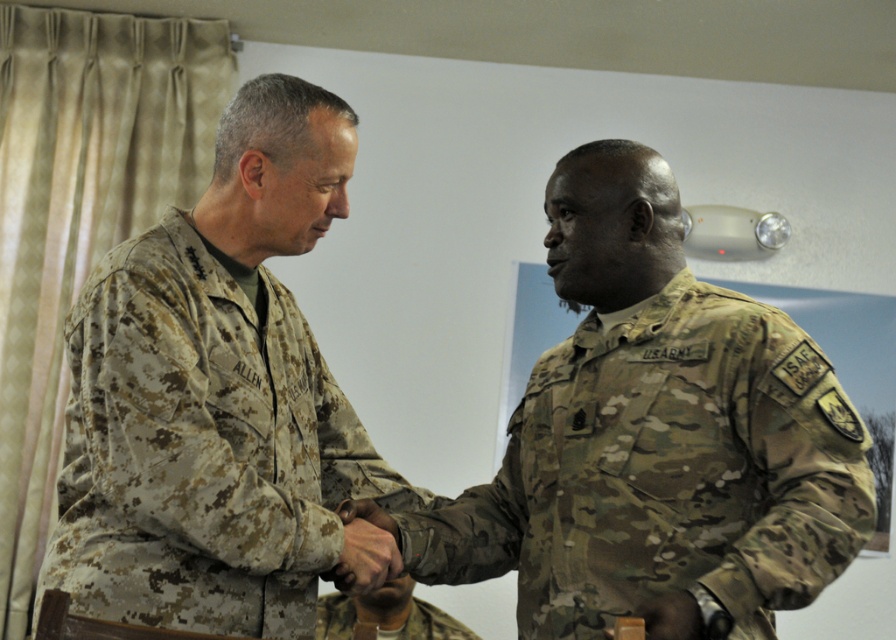
Question: Which of the following is the closest to the observer?

Choices:
 (A) (382, 605)
 (B) (623, 371)
 (C) (122, 371)

Answer: (C)

Question: Is camouflage uniform at center to the left of camouflage uniform at left from the viewer's perspective?

Choices:
 (A) no
 (B) yes

Answer: (A)

Question: Is camouflage uniform at center wider than camouflage fabric uniform at center?

Choices:
 (A) no
 (B) yes

Answer: (B)

Question: Which of the following is the closest to the observer?

Choices:
 (A) camouflage uniform at center
 (B) camouflage uniform at left
 (C) camouflage fabric uniform at center

Answer: (A)

Question: Can you confirm if camouflage uniform at left is bigger than camouflage fabric uniform at center?

Choices:
 (A) yes
 (B) no

Answer: (A)

Question: Estimate the real-world distances between objects in this image. Which object is farther from the camouflage fabric uniform at center?

Choices:
 (A) camouflage uniform at left
 (B) camouflage uniform at center

Answer: (B)